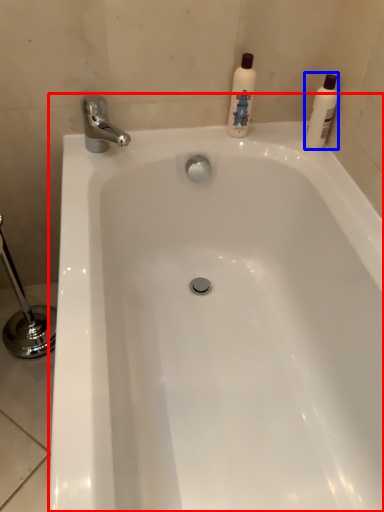
Question: Which point is closer to the camera, bathtub (highlighted by a red box) or cleaning product (highlighted by a blue box)?

Choices:
 (A) bathtub
 (B) cleaning product

Answer: (A)